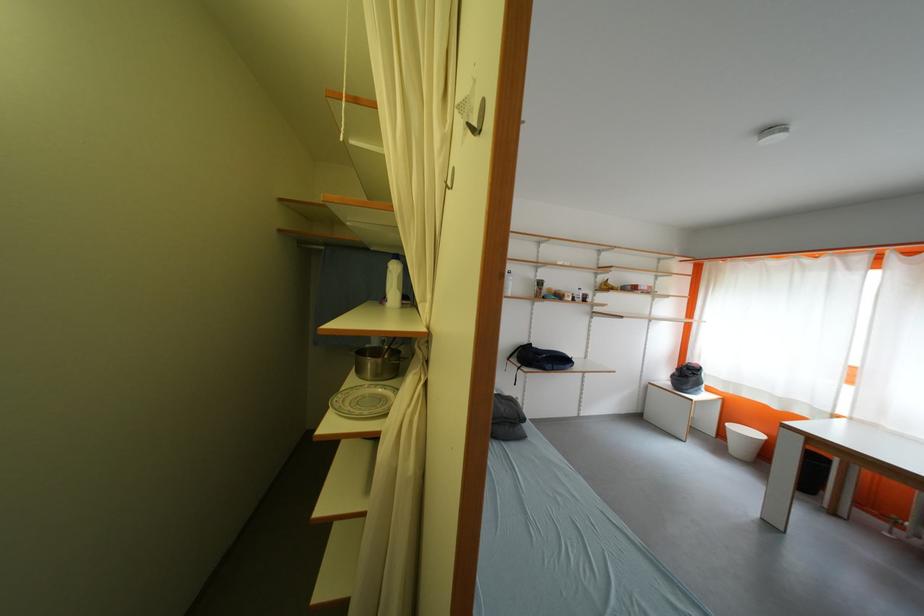
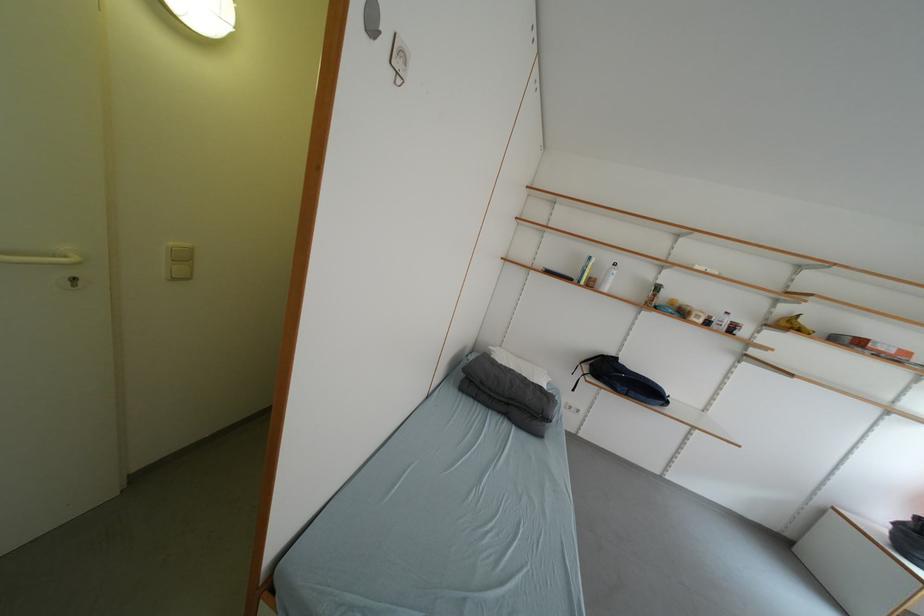
Where in the second image is the point corresponding to the point at 655,391 from the first image?

(832, 515)